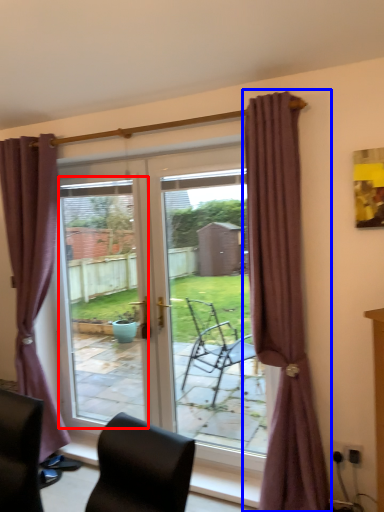
Question: Among these objects, which one is nearest to the camera, window screen (highlighted by a red box) or curtain (highlighted by a blue box)?

Choices:
 (A) window screen
 (B) curtain

Answer: (B)